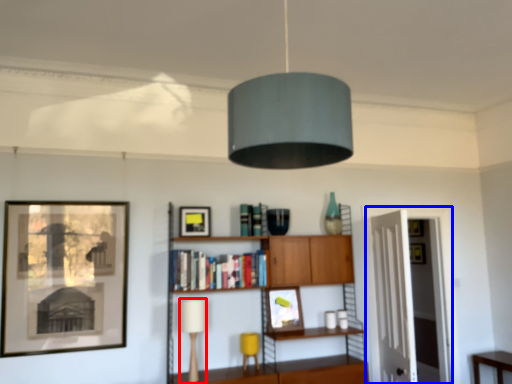
Question: Which object is further to the camera taking this photo, table lamp (highlighted by a red box) or glass door (highlighted by a blue box)?

Choices:
 (A) table lamp
 (B) glass door

Answer: (B)